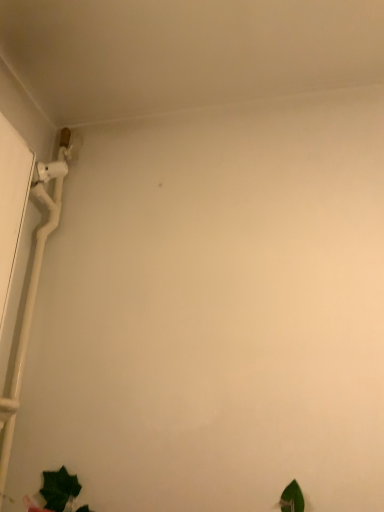
You are a GUI agent. You are given a task and a screenshot of the screen. Output one action in this format:
    pyautogui.click(x=<x>, y=<y>)
    Task: Click on the green matte leaf at lower right
    The image size is (384, 512).
    Given the screenshot: What is the action you would take?
    pyautogui.click(x=292, y=498)

What do you see at coordinates (292, 498) in the screenshot?
I see `green matte leaf at lower right` at bounding box center [292, 498].

At what (x,y) coordinates should I click in order to perform the action: click on green matte leaf at lower right. Please return your answer as a coordinate pair (x, y). The image size is (384, 512). Looking at the image, I should click on (292, 498).